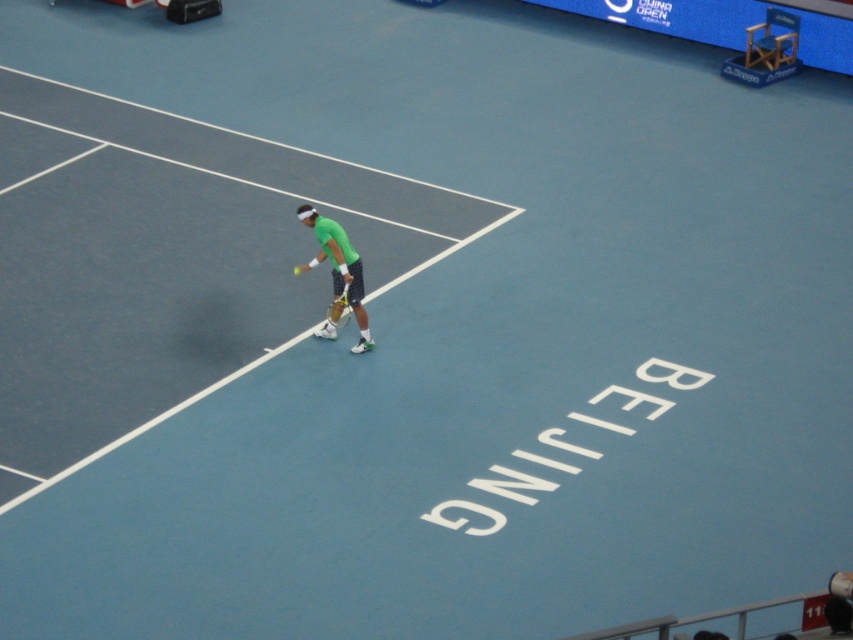
Question: In this image, where is green matte tennis racket at center located relative to yellow-green synthetic racket at center?

Choices:
 (A) right
 (B) left

Answer: (B)

Question: Can you confirm if green matte tennis racket at center is smaller than yellow-green synthetic racket at center?

Choices:
 (A) yes
 (B) no

Answer: (B)

Question: Which point appears farthest from the camera in this image?

Choices:
 (A) (341, 300)
 (B) (334, 323)

Answer: (B)

Question: Is green matte tennis racket at center behind yellow-green synthetic racket at center?

Choices:
 (A) no
 (B) yes

Answer: (A)